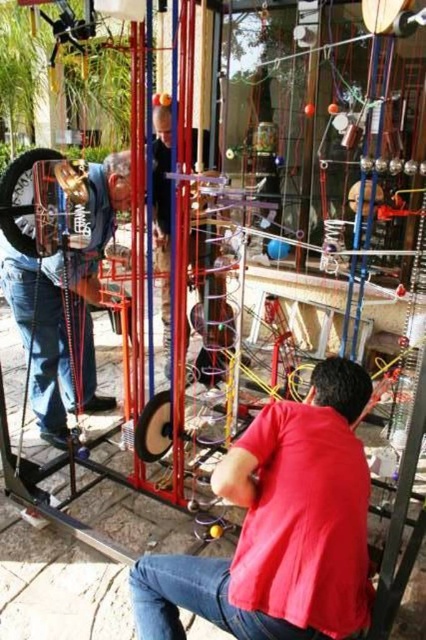
Question: Which of the following is the farthest from the observer?

Choices:
 (A) matte gold necklace at left
 (B) blue denim jeans at lower left
 (C) jeans at lower center
 (D) red matte shirt at center

Answer: (B)

Question: Is red matte shirt at center thinner than matte black shirt at center?

Choices:
 (A) yes
 (B) no

Answer: (B)

Question: Estimate the real-world distances between objects in this image. Which object is farther from the matte black shirt at center?

Choices:
 (A) jeans at lower center
 (B) red matte shirt at center
 (C) matte gold necklace at left

Answer: (A)

Question: Which of the following is the farthest from the observer?

Choices:
 (A) red matte shirt at center
 (B) blue denim jeans at lower left

Answer: (B)

Question: Can you confirm if red matte shirt at center is smaller than blue denim jeans at lower left?

Choices:
 (A) yes
 (B) no

Answer: (B)

Question: Does jeans at lower center appear on the right side of matte black shirt at center?

Choices:
 (A) yes
 (B) no

Answer: (A)